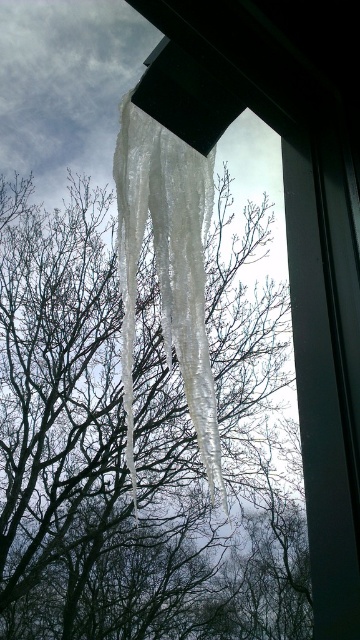
Is transparent ice icicles at center positioned in front of clear ice icicles at center?

No, transparent ice icicles at center is further to the viewer.

Find the location of a particular element. The height and width of the screenshot is (640, 360). transparent ice icicles at center is located at coordinates (137, 442).

Where is `transparent ice icicles at center`? The height and width of the screenshot is (640, 360). transparent ice icicles at center is located at coordinates (137, 442).